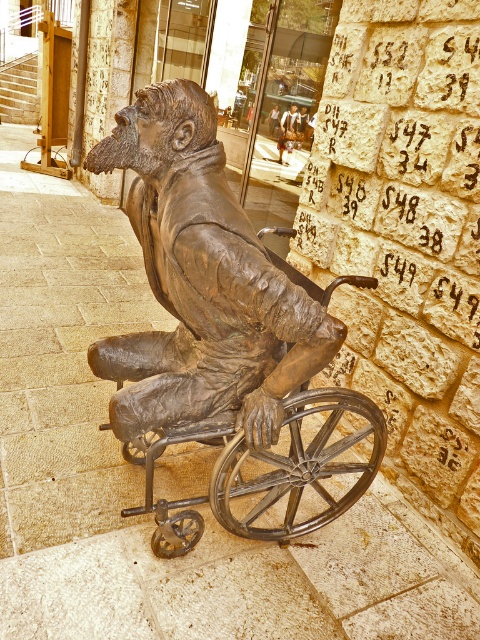
Question: Which of the following is the farthest from the observer?

Choices:
 (A) bronze statue of man at center
 (B) bronze metal wheelchair at center
 (C) bronze statue at center

Answer: (A)

Question: Does bronze statue at center have a lesser width compared to bronze metal wheelchair at center?

Choices:
 (A) no
 (B) yes

Answer: (B)

Question: Considering the real-world distances, which object is closest to the bronze metal wheelchair at center?

Choices:
 (A) bronze statue of man at center
 (B) bronze statue at center

Answer: (B)

Question: Considering the relative positions of bronze statue at center and bronze metal wheelchair at center in the image provided, where is bronze statue at center located with respect to bronze metal wheelchair at center?

Choices:
 (A) left
 (B) right

Answer: (A)

Question: Which object is the closest to the bronze statue of man at center?

Choices:
 (A) bronze metal wheelchair at center
 (B) bronze statue at center

Answer: (A)

Question: Is the position of bronze statue at center more distant than that of bronze statue of man at center?

Choices:
 (A) yes
 (B) no

Answer: (B)